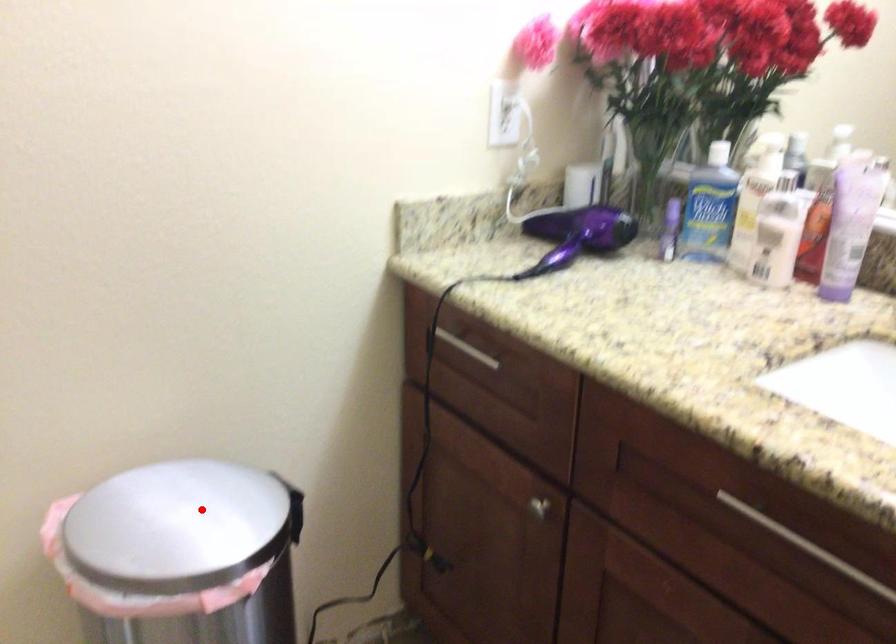
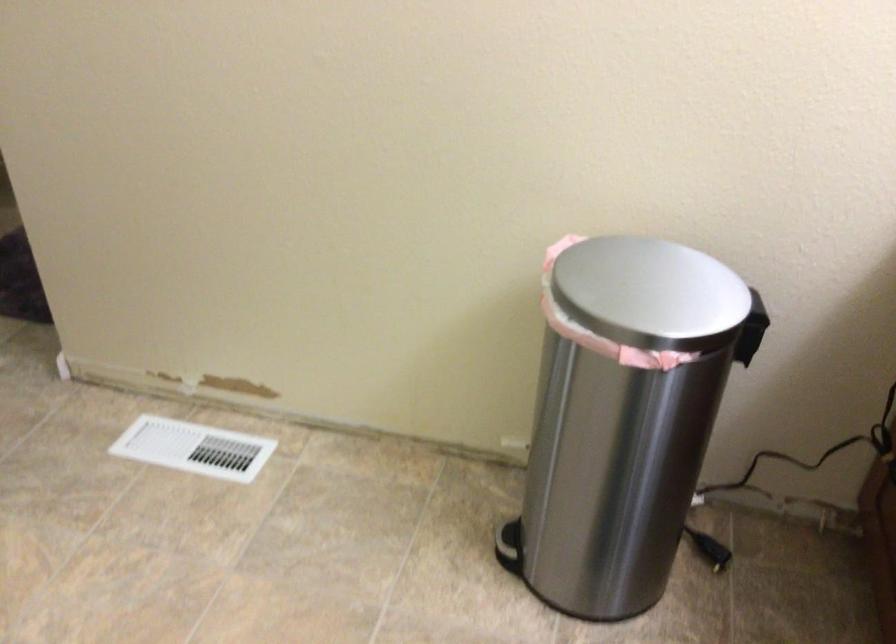
The point at the highlighted location is marked in the first image. Where is the corresponding point in the second image?

(658, 288)